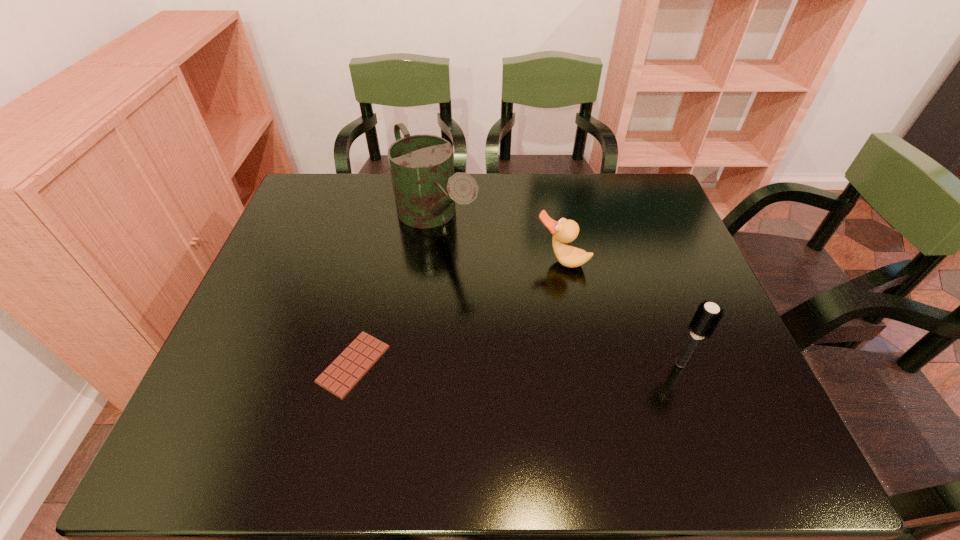
At what (x,y) coordinates should I click in order to perform the action: click on free spot between the third shortest object and the third tallest object. Please return your answer as a coordinate pair (x, y). Looking at the image, I should click on (621, 312).

Where is `vacant space in between the third shortest object and the candy bar`? This screenshot has height=540, width=960. vacant space in between the third shortest object and the candy bar is located at coordinates (517, 364).

Where is `blank region between the hairbrush and the third tallest object`? blank region between the hairbrush and the third tallest object is located at coordinates (621, 312).

Locate an element on the screen. The image size is (960, 540). the third closest object to the shortest object is located at coordinates (708, 315).

You are a GUI agent. You are given a task and a screenshot of the screen. Output one action in this format:
    pyautogui.click(x=<x>, y=<y>)
    Task: Click on the object that can be found as the second closest to the rightmost object
    The height and width of the screenshot is (540, 960).
    Given the screenshot: What is the action you would take?
    pyautogui.click(x=425, y=187)

Find the location of `vacant space that satisfies the following two spatial constraints: 1. on the front side of the second tallest object; 2. on the right side of the second object from right to left`. vacant space that satisfies the following two spatial constraints: 1. on the front side of the second tallest object; 2. on the right side of the second object from right to left is located at coordinates (581, 363).

The width and height of the screenshot is (960, 540). Identify the location of free point that satisfies the following two spatial constraints: 1. on the front side of the duck; 2. on the right side of the rightmost object. (581, 363).

Find the location of `free region that satisfies the following two spatial constraints: 1. on the front side of the watering can; 2. on the left side of the third object from left to right`. free region that satisfies the following two spatial constraints: 1. on the front side of the watering can; 2. on the left side of the third object from left to right is located at coordinates (432, 261).

Identify the location of free space that satisfies the following two spatial constraints: 1. on the front side of the watering can; 2. on the left side of the hairbrush. The image size is (960, 540). (420, 363).